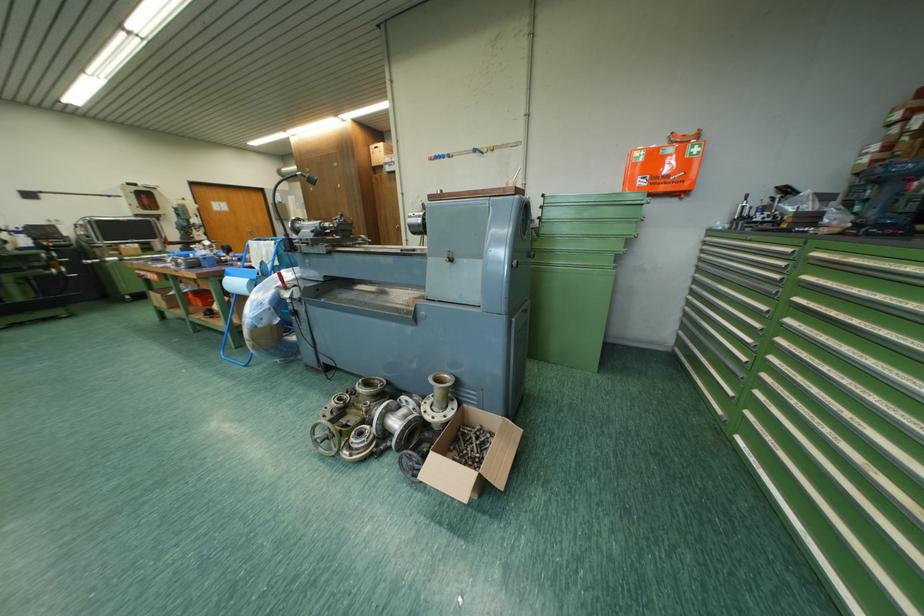
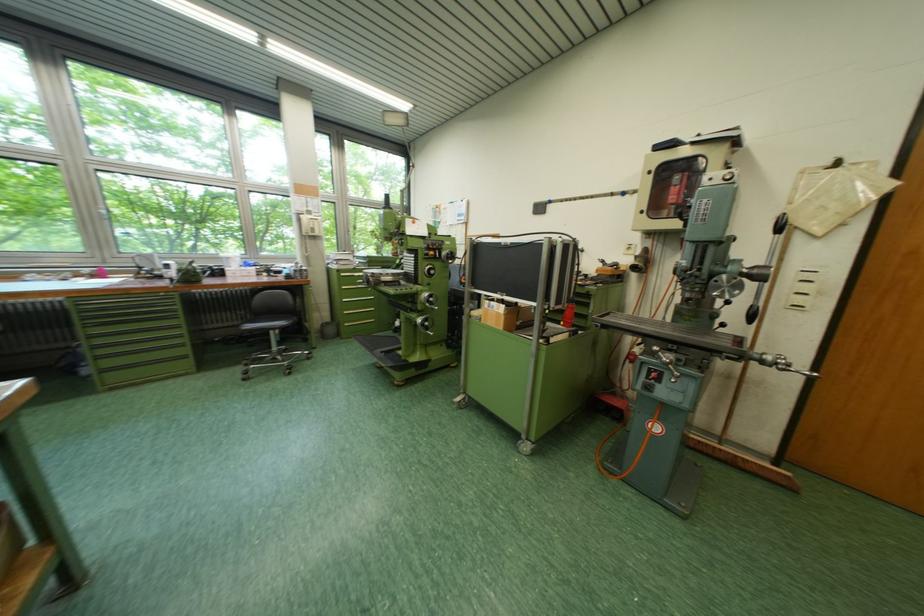
The point at (x=138, y=246) is marked in the first image. Where is the corresponding point in the second image?

(503, 305)